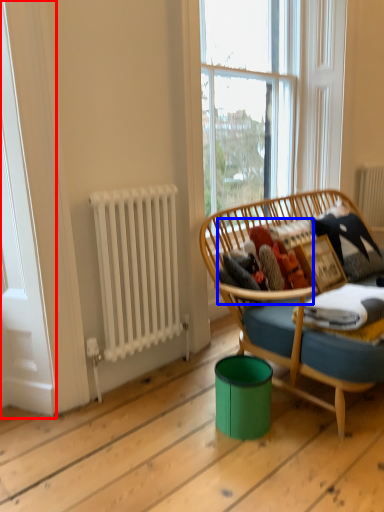
Question: Which object appears farthest to the camera in this image, screen door (highlighted by a red box) or clothing (highlighted by a blue box)?

Choices:
 (A) screen door
 (B) clothing

Answer: (B)